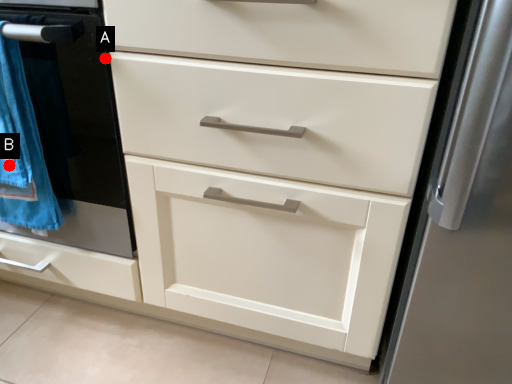
Question: Two points are circled on the image, labeled by A and B beside each circle. Which of the following is the farthest from the observer?

Choices:
 (A) A is further
 (B) B is further

Answer: (B)